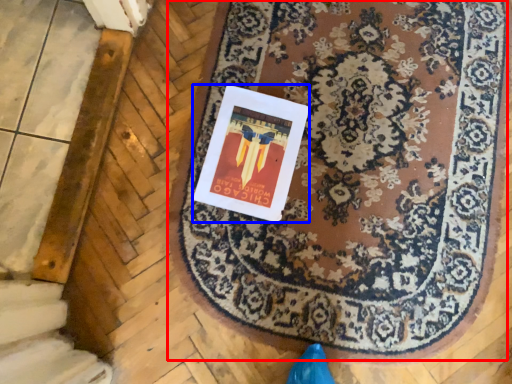
Question: Which point is closer to the camera, mat (highlighted by a red box) or postcard (highlighted by a blue box)?

Choices:
 (A) mat
 (B) postcard

Answer: (A)